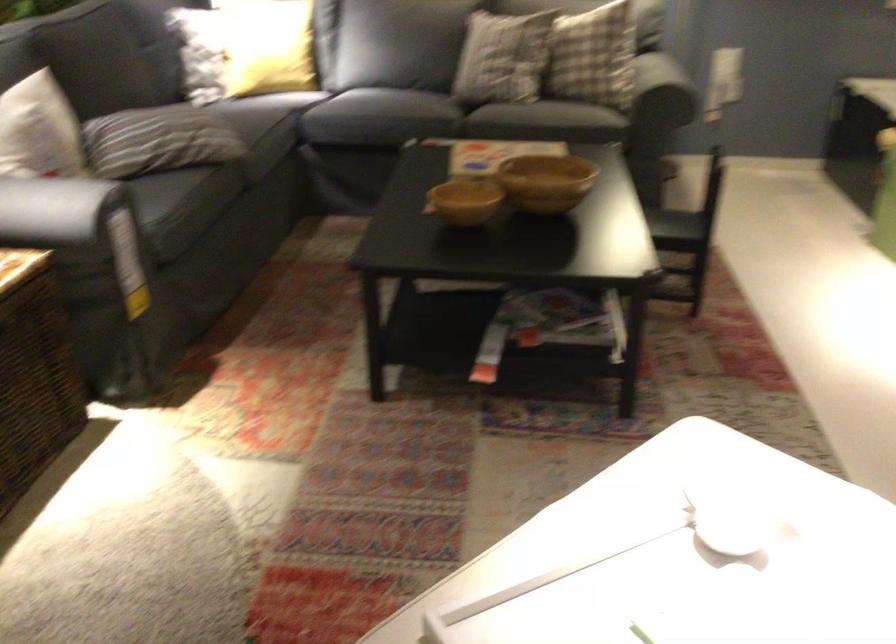
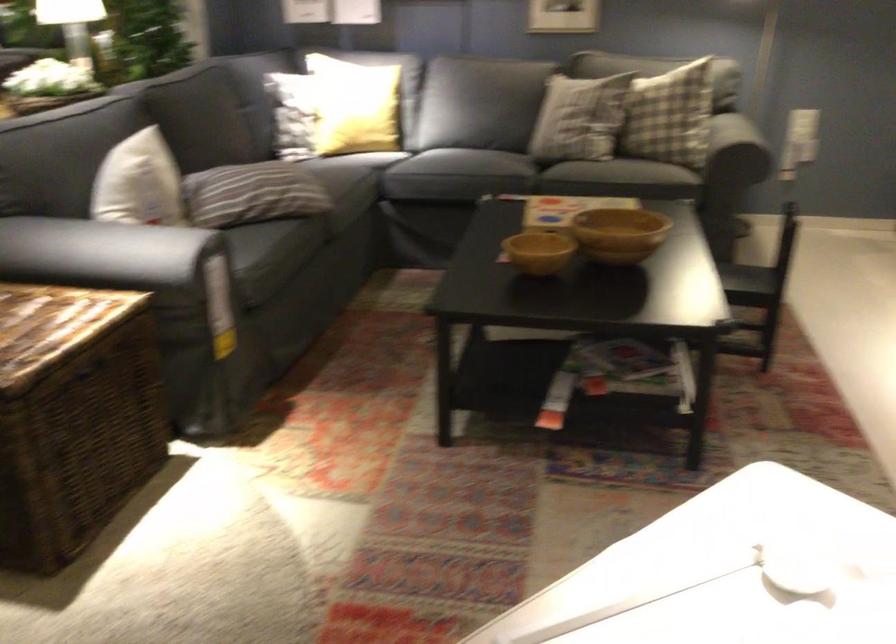
Find the pixel in the second image that matches the point at 174,140 in the first image.

(261, 194)